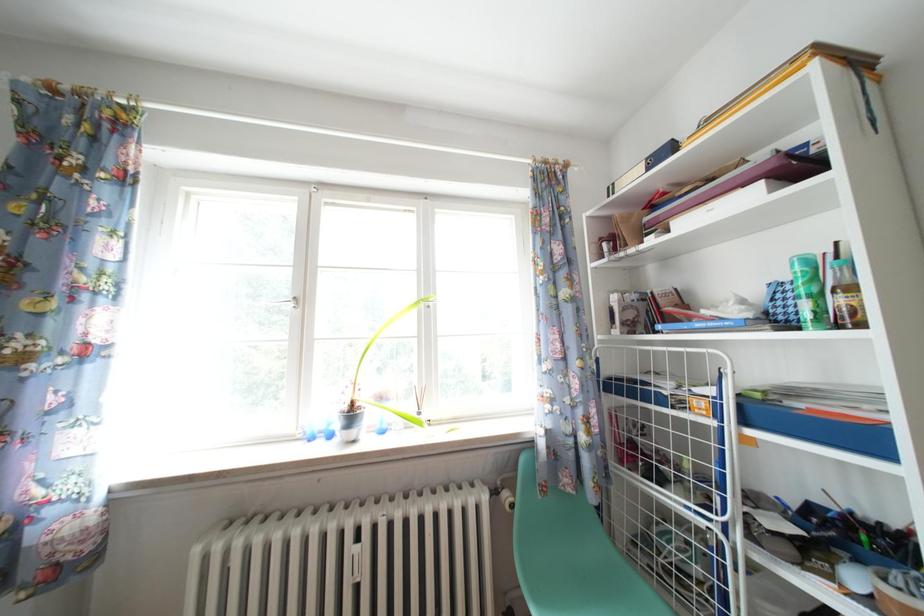
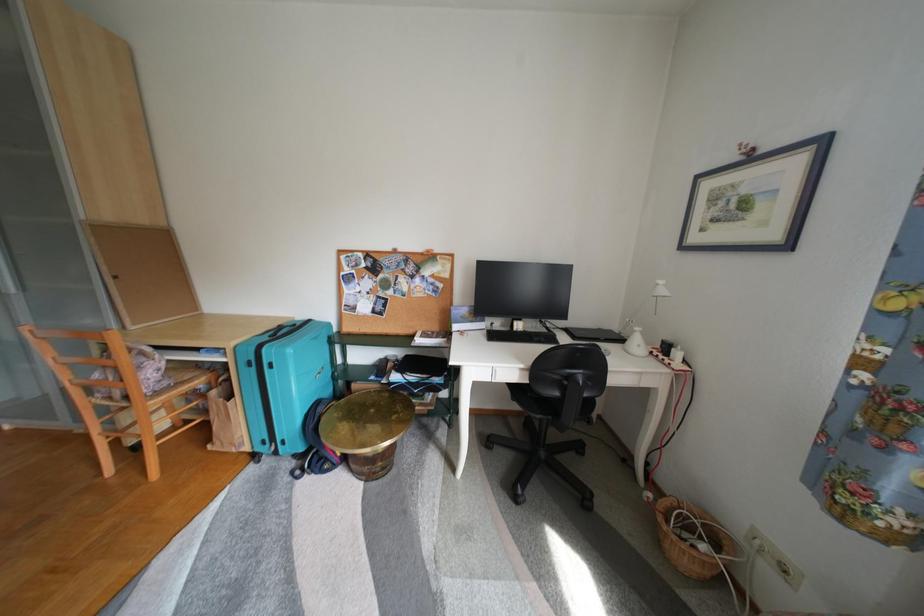
Question: The camera is either moving clockwise (left) or counter-clockwise (right) around the object. The first image is from the beginning of the video and the second image is from the end. Is the camera moving left or right when shooting the video?

Choices:
 (A) Left
 (B) Right

Answer: (B)